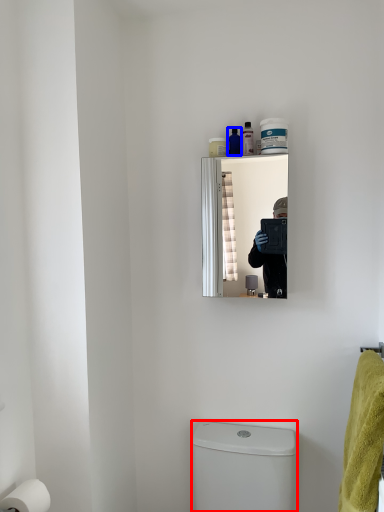
Question: Which of the following is the closest to the observer, toilet bowl (highlighted by a red box) or toiletry (highlighted by a blue box)?

Choices:
 (A) toilet bowl
 (B) toiletry

Answer: (A)